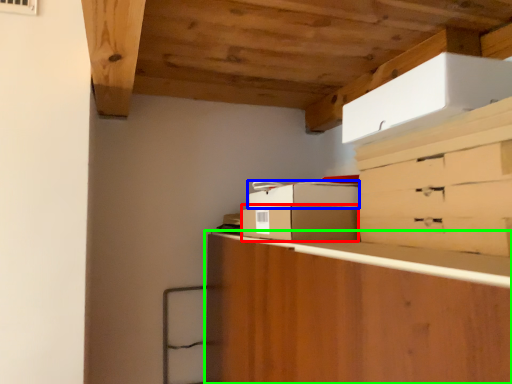
Question: Based on their relative distances, which object is nearer to cardboard box (highlighted by a red box)? Choose from cardboard box (highlighted by a blue box) and cabinetry (highlighted by a green box).

Choices:
 (A) cardboard box
 (B) cabinetry

Answer: (A)